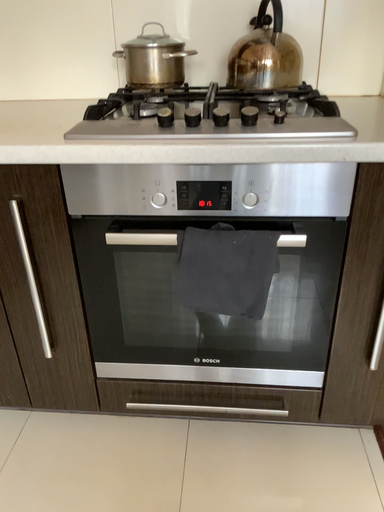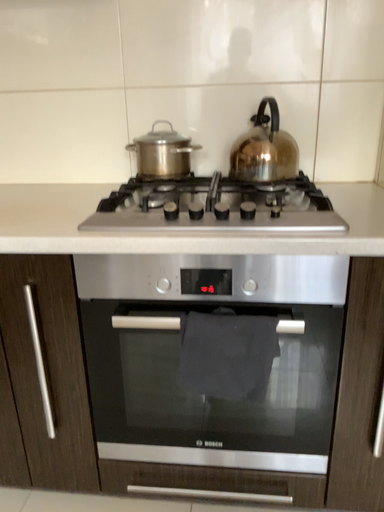
Question: Which way did the camera rotate in the video?

Choices:
 (A) rotated upward
 (B) rotated downward

Answer: (A)